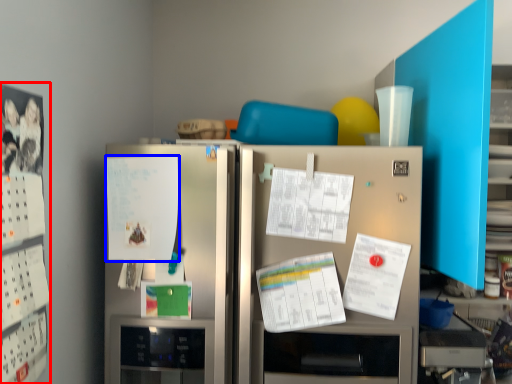
Question: Which point is closer to the camera, bulletin board (highlighted by a red box) or poster (highlighted by a blue box)?

Choices:
 (A) bulletin board
 (B) poster

Answer: (A)